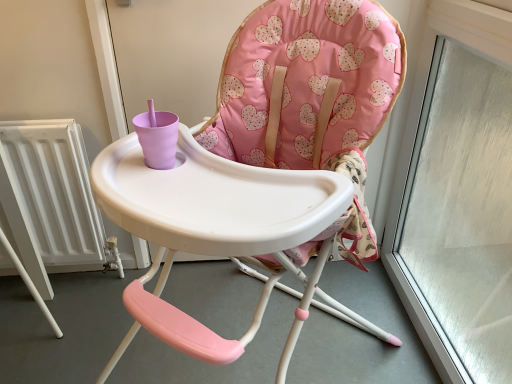
Find the location of a particular element. Image resolution: width=512 pixels, height=384 pixels. free region under white metallic radiator at left (from a real-world perspective) is located at coordinates (76, 280).